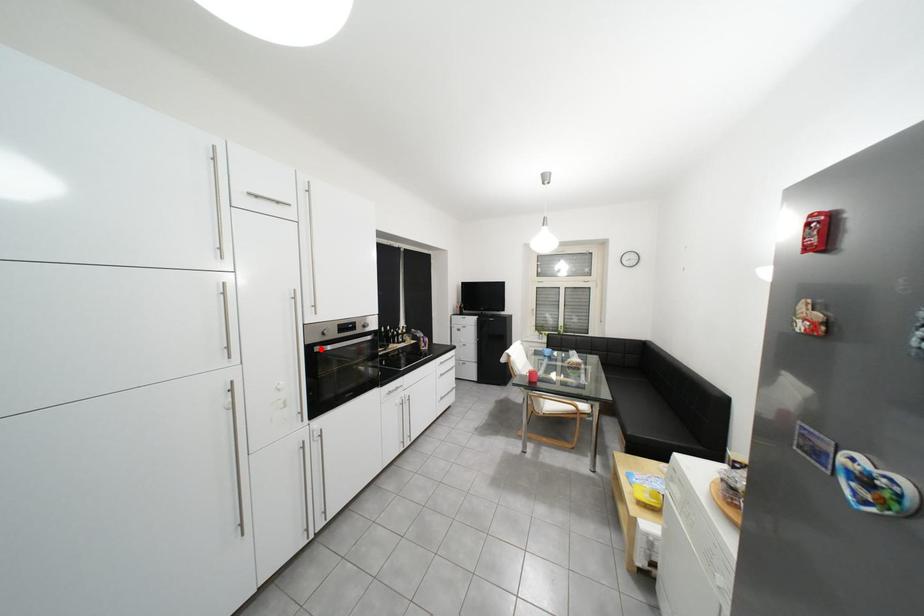
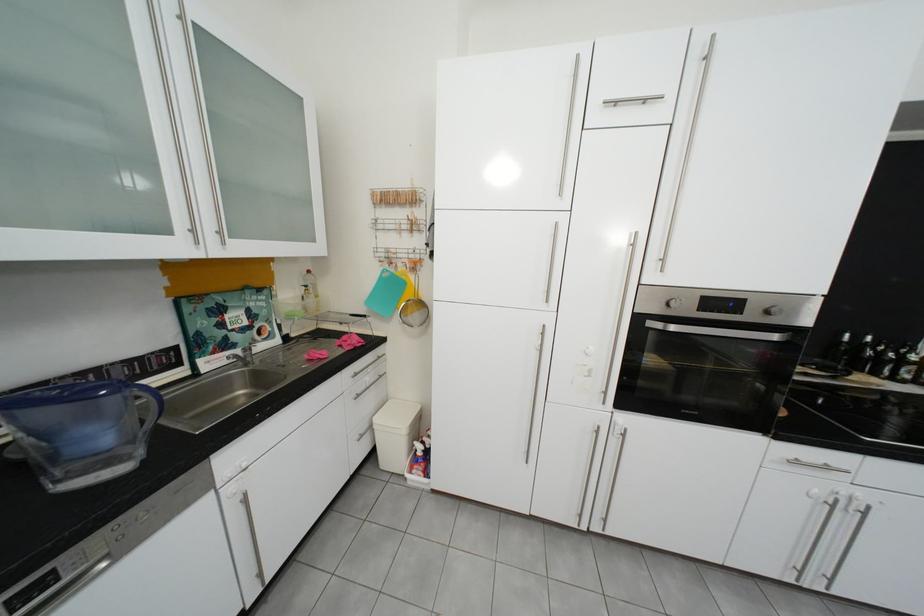
The point at the highlighted location is marked in the first image. Where is the corresponding point in the second image?

(650, 320)